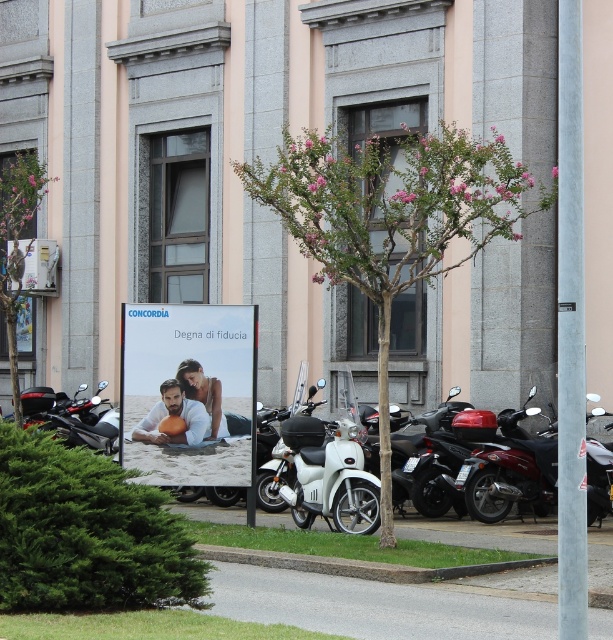
Consider the image. Is white matte scooter at center to the left of smooth skin person at center from the viewer's perspective?

No, white matte scooter at center is not to the left of smooth skin person at center.

Does white matte scooter at center have a lesser height compared to smooth skin person at center?

No, white matte scooter at center is not shorter than smooth skin person at center.

Which is in front, point (310, 493) or point (218, 426)?

Point (310, 493) is in front.

Find the location of `white matte scooter at center`. white matte scooter at center is located at coordinates (324, 468).

Does shiny black scooter at center have a smaller size compared to smooth skin person at center?

No.

Is shiny black scooter at center shorter than smooth skin person at center?

No.

Is point (440, 504) farther from viewer compared to point (204, 396)?

Yes, point (440, 504) is farther from viewer.

At what (x,y) coordinates should I click in order to perform the action: click on shiny black scooter at center. Please return your answer as a coordinate pair (x, y). This screenshot has width=613, height=640. Looking at the image, I should click on (438, 474).

Is the position of matte white billboard at center more distant than that of shiny black scooter at center?

No.

Who is taller, matte white billboard at center or shiny black scooter at center?

matte white billboard at center

Where is `matte white billboard at center`? This screenshot has width=613, height=640. matte white billboard at center is located at coordinates (186, 392).